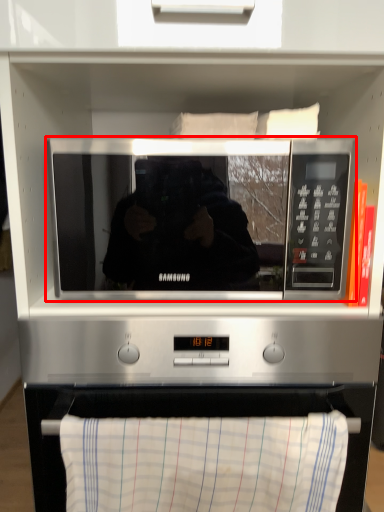
Question: Considering the relative positions of microwave oven (annotated by the red box) and cloth in the image provided, where is microwave oven (annotated by the red box) located with respect to the staircase?

Choices:
 (A) left
 (B) right

Answer: (A)